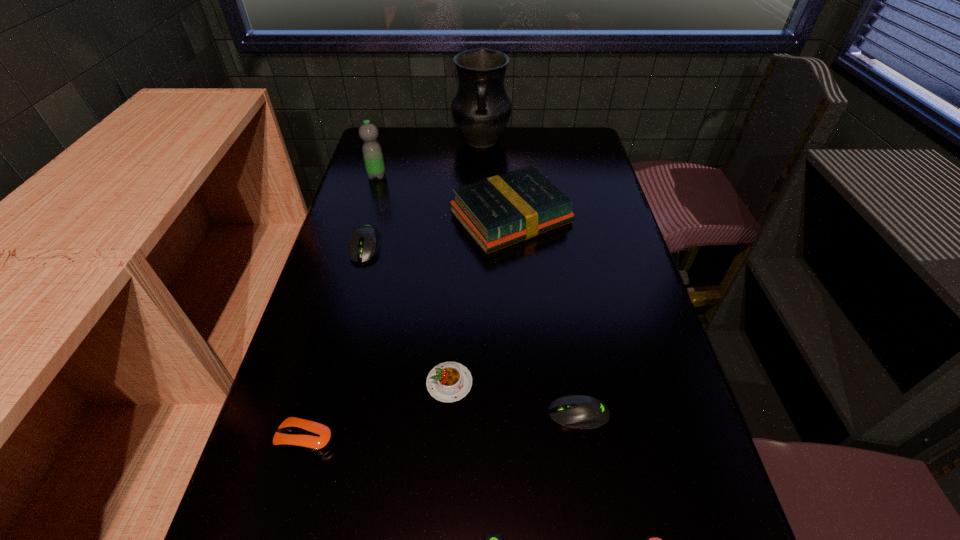
Identify the location of blank area in the image that satisfies the following two spatial constraints: 1. on the handle side of the hardback book; 2. on the left side of the tallest object. The image size is (960, 540). (482, 217).